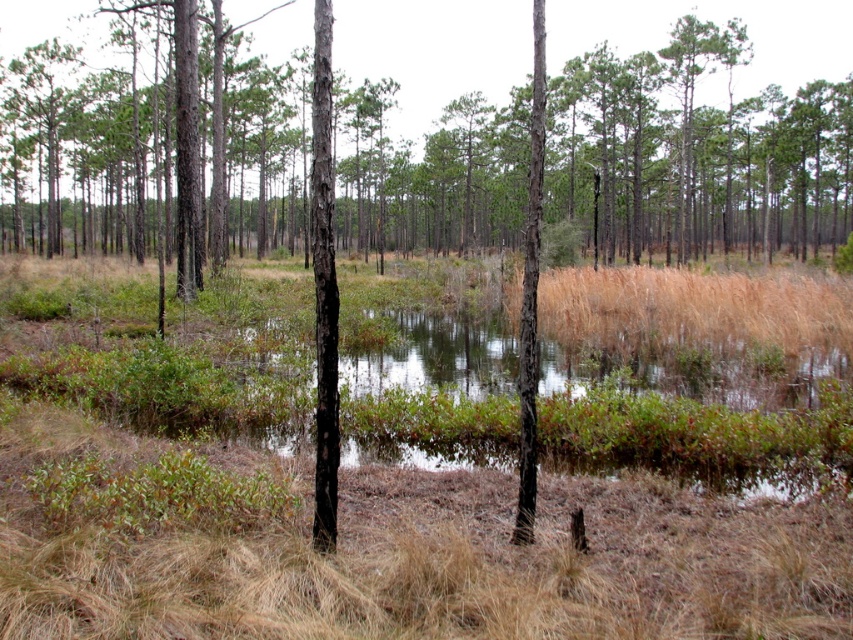
Question: Can you confirm if green bark tree at center is positioned below smooth bark tree at center?

Choices:
 (A) yes
 (B) no

Answer: (B)

Question: Among these objects, which one is farthest from the camera?

Choices:
 (A) smooth bark tree at center
 (B) green bark tree at center

Answer: (A)

Question: Can you confirm if green bark tree at center is thinner than smooth bark tree at center?

Choices:
 (A) no
 (B) yes

Answer: (A)

Question: Among these points, which one is farthest from the camera?

Choices:
 (A) (527, 442)
 (B) (350, 20)

Answer: (B)

Question: Can you confirm if green bark tree at center is bigger than smooth bark tree at center?

Choices:
 (A) yes
 (B) no

Answer: (A)